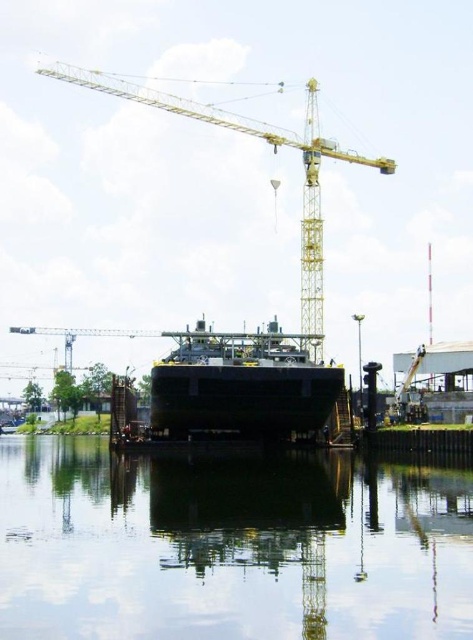
Consider the image. Is transparent glass water at center to the right of black matte ship at center from the viewer's perspective?

No, transparent glass water at center is not to the right of black matte ship at center.

Between transparent glass water at center and black matte ship at center, which one appears on the right side from the viewer's perspective?

black matte ship at center is more to the right.

Find the location of a particular element. The height and width of the screenshot is (640, 473). transparent glass water at center is located at coordinates (228, 547).

Find the location of a particular element. transparent glass water at center is located at coordinates (228, 547).

Which is below, transparent glass water at center or yellow metallic crane at upper center?

transparent glass water at center

From the picture: Does transparent glass water at center appear under yellow metallic crane at upper center?

Indeed, transparent glass water at center is positioned under yellow metallic crane at upper center.

Between point (5, 576) and point (303, 310), which one is positioned behind?

The point (303, 310) is behind.

Where is `transparent glass water at center`? The height and width of the screenshot is (640, 473). transparent glass water at center is located at coordinates (228, 547).

Can you confirm if black matte ship at center is positioned below yellow metallic crane at upper center?

Indeed, black matte ship at center is positioned under yellow metallic crane at upper center.

Is black matte ship at center smaller than yellow metallic crane at upper center?

Yes.

Who is more forward, (326, 387) or (316, 308)?

Point (326, 387) is more forward.

Find the location of a particular element. Image resolution: width=473 pixels, height=640 pixels. black matte ship at center is located at coordinates (241, 385).